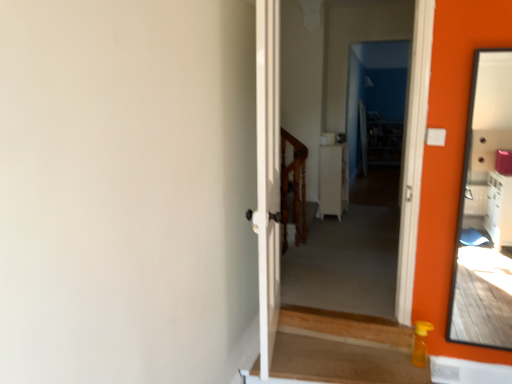
Find the location of a particular element. This screenshot has height=384, width=512. free location in front of white glossy cabinet at center is located at coordinates (351, 226).